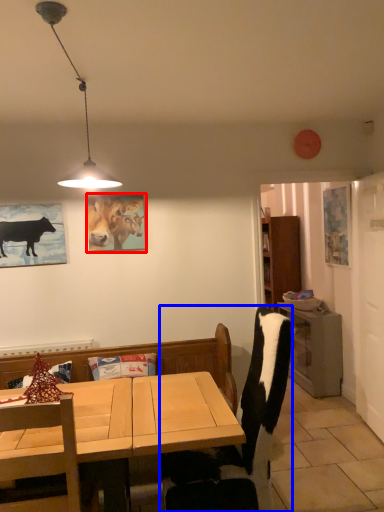
Question: Which of the following is the farthest to the observer, picture frame (highlighted by a red box) or chair (highlighted by a blue box)?

Choices:
 (A) picture frame
 (B) chair

Answer: (A)